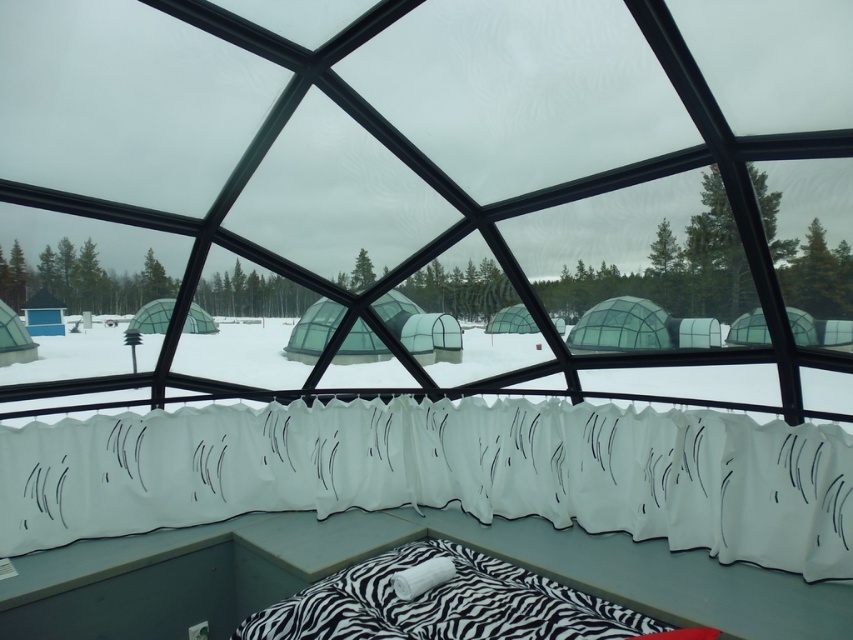
Does transparent glass window at center appear over transparent plastic dome at center?

Yes, transparent glass window at center is above transparent plastic dome at center.

Can you confirm if transparent glass window at center is thinner than transparent plastic dome at center?

No.

Locate an element on the screen. The height and width of the screenshot is (640, 853). transparent glass window at center is located at coordinates (432, 193).

Is white soft pillow at lower center above matte black dome at left?

Incorrect, white soft pillow at lower center is not positioned above matte black dome at left.

Is point (442, 561) positioned behind point (33, 305)?

No, it is not.

Does point (444, 557) lie behind point (28, 300)?

That is False.

The width and height of the screenshot is (853, 640). Find the location of `white soft pillow at lower center`. white soft pillow at lower center is located at coordinates (422, 577).

Does zebra-patterned fabric bed at center appear under white soft pillow at lower center?

Yes, zebra-patterned fabric bed at center is below white soft pillow at lower center.

Between point (486, 582) and point (405, 580), which one is positioned behind?

The point (486, 582) is more distant.

You are a GUI agent. You are given a task and a screenshot of the screen. Output one action in this format:
    pyautogui.click(x=<x>, y=<y>)
    Task: Click on the zebra-patterned fabric bed at center
    This screenshot has width=853, height=640.
    Given the screenshot: What is the action you would take?
    pyautogui.click(x=450, y=604)